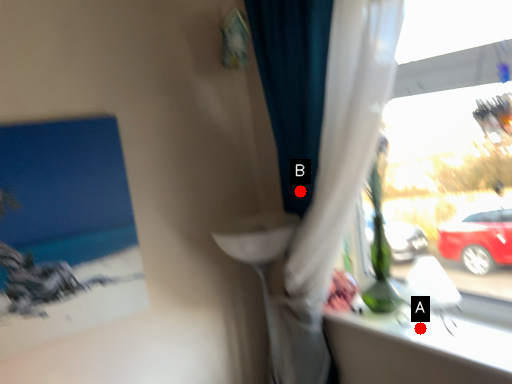
Question: Two points are circled on the image, labeled by A and B beside each circle. Which of the following is the farthest from the observer?

Choices:
 (A) A is further
 (B) B is further

Answer: (B)